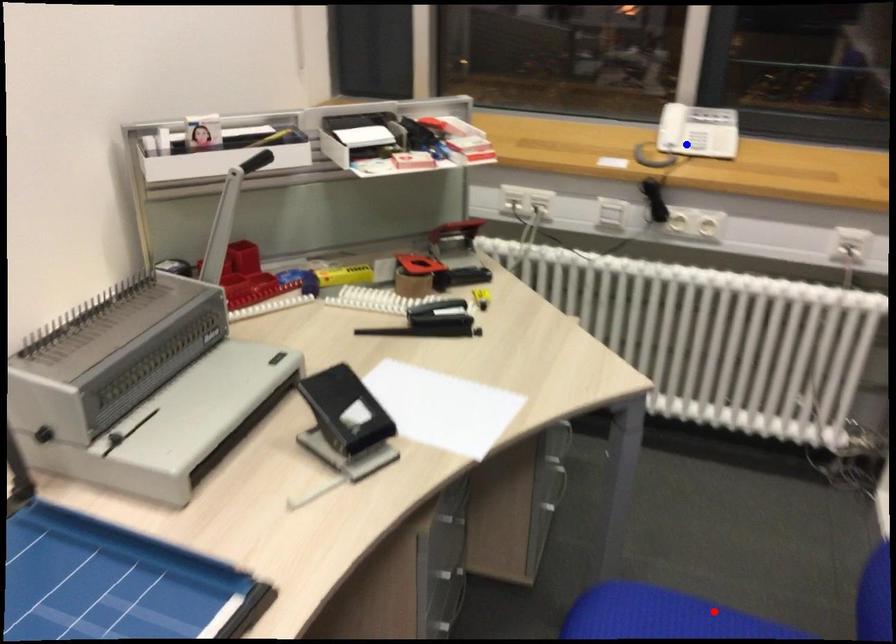
Question: Two points are marked on the image. Which point is closer to the camera?

Choices:
 (A) Blue point is closer.
 (B) Red point is closer.

Answer: (B)